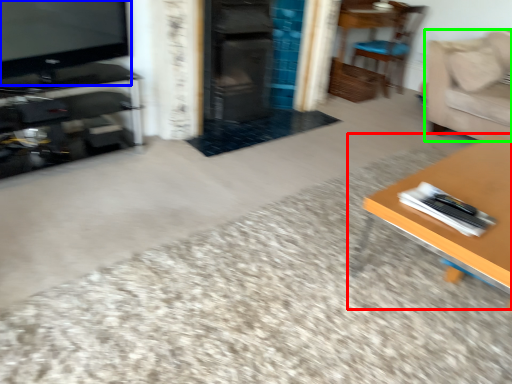
Question: Based on their relative distances, which object is farther from table (highlighted by a red box)? Choose from television (highlighted by a blue box) and couch (highlighted by a green box).

Choices:
 (A) television
 (B) couch

Answer: (A)